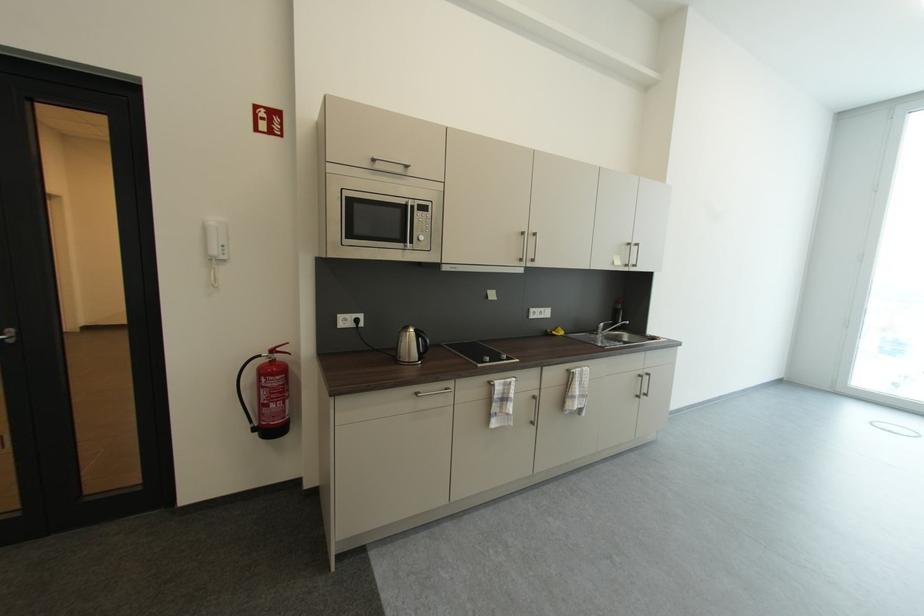
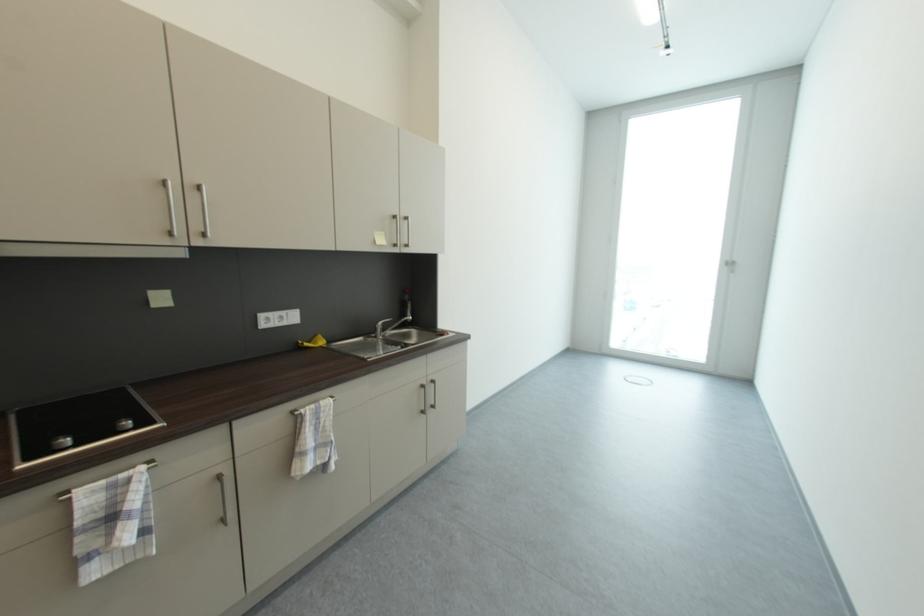
In a continuous first-person perspective shot, in which direction is the camera moving?

The movement direction of the cameraman is right, forward.